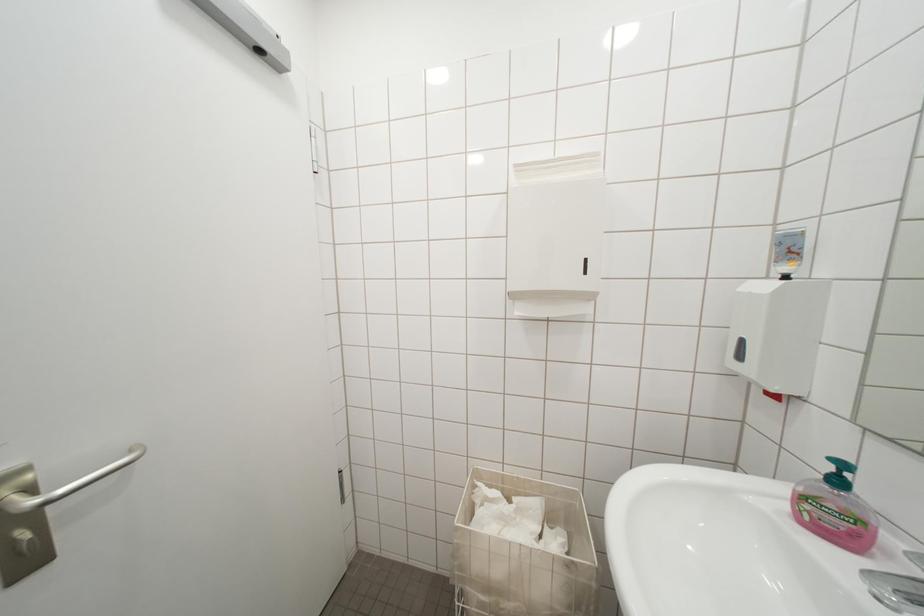
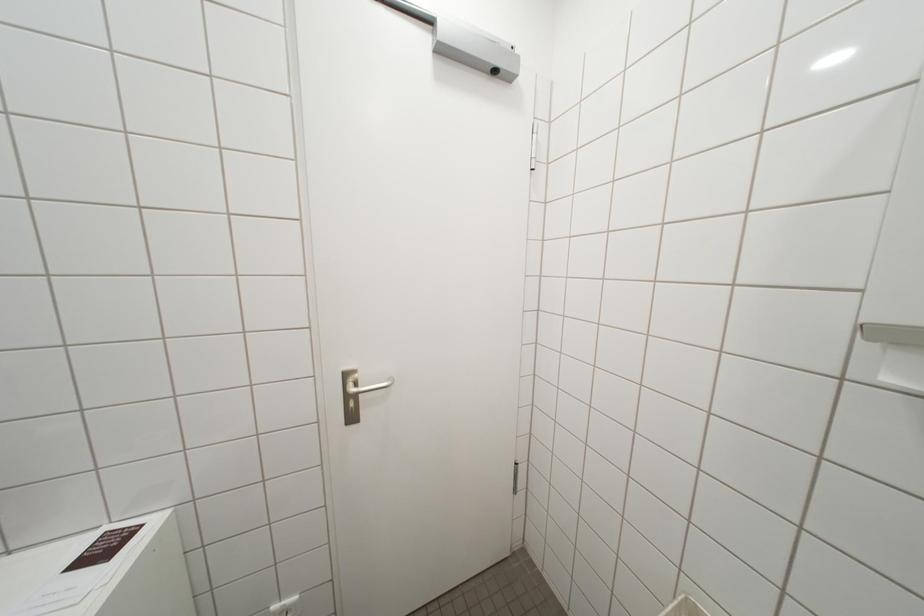
Question: The images are taken continuously from a first-person perspective. In which direction is your viewpoint rotating?

Choices:
 (A) Left
 (B) Right
 (C) Up
 (D) Down

Answer: (A)